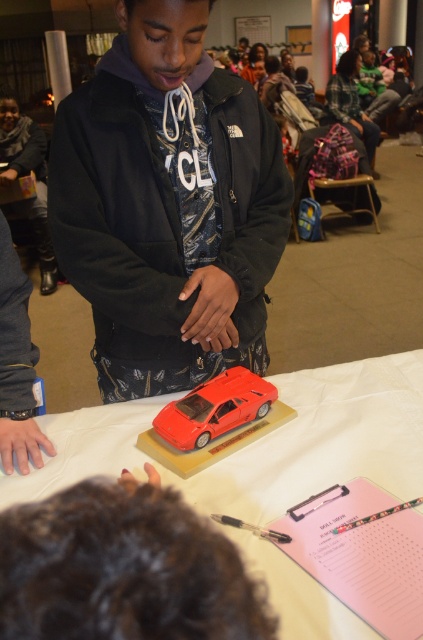
Question: Which object is farther from the camera taking this photo?

Choices:
 (A) plaid fabric jacket at upper right
 (B) glossy plastic car at center

Answer: (A)

Question: Is glossy plastic car at center smaller than shiny red car at center?

Choices:
 (A) no
 (B) yes

Answer: (A)

Question: Observing the image, what is the correct spatial positioning of shiny red car at center in reference to plaid fabric jacket at upper right?

Choices:
 (A) right
 (B) left

Answer: (B)

Question: Is glossy plastic car at center to the left of plaid fabric jacket at upper right from the viewer's perspective?

Choices:
 (A) yes
 (B) no

Answer: (A)

Question: Among these points, which one is farthest from the camera?

Choices:
 (A) [x=197, y=432]
 (B) [x=365, y=131]
 (C) [x=255, y=563]

Answer: (B)

Question: Which point is farther from the camera taking this photo?

Choices:
 (A) (349, 90)
 (B) (390, 484)

Answer: (A)